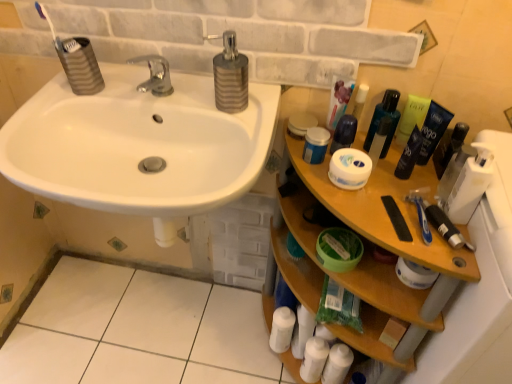
Image resolution: width=512 pixels, height=384 pixels. What are the coordinates of `vacant space in front of white matte jar at center` in the screenshot? It's located at (378, 221).